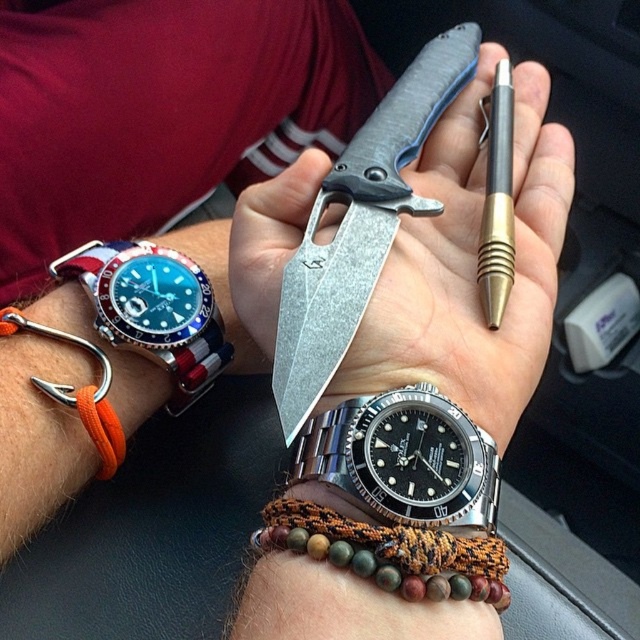
Is black stainless steel watch at center to the right of blue dial steel watch at left from the viewer's perspective?

Correct, you'll find black stainless steel watch at center to the right of blue dial steel watch at left.

Is black stainless steel watch at center smaller than blue dial steel watch at left?

Correct, black stainless steel watch at center occupies less space than blue dial steel watch at left.

Between point (339, 435) and point (188, 268), which one is positioned in front?

Positioned in front is point (339, 435).

You are a GUI agent. You are given a task and a screenshot of the screen. Output one action in this format:
    pyautogui.click(x=<x>, y=<y>)
    Task: Click on the black stainless steel watch at center
    The height and width of the screenshot is (640, 640).
    Given the screenshot: What is the action you would take?
    pyautogui.click(x=404, y=458)

Is metallic gray knife at center further to camera compared to matte black pen at center?

No, metallic gray knife at center is closer to the viewer.

Does metallic gray knife at center have a larger size compared to matte black pen at center?

Yes, metallic gray knife at center is bigger than matte black pen at center.

Is point (432, 262) positioned after point (488, 150)?

That is False.

Where is `metallic gray knife at center`? metallic gray knife at center is located at coordinates (470, 262).

Is point (360, 426) positioned before point (486, 250)?

Yes, it is in front of point (486, 250).

Between point (400, 424) and point (500, 134), which one is positioned behind?

The point (500, 134) is behind.

This screenshot has width=640, height=640. What do you see at coordinates (404, 458) in the screenshot?
I see `black stainless steel watch at center` at bounding box center [404, 458].

At what (x,y) coordinates should I click in order to perform the action: click on black stainless steel watch at center. Please return your answer as a coordinate pair (x, y). Looking at the image, I should click on (404, 458).